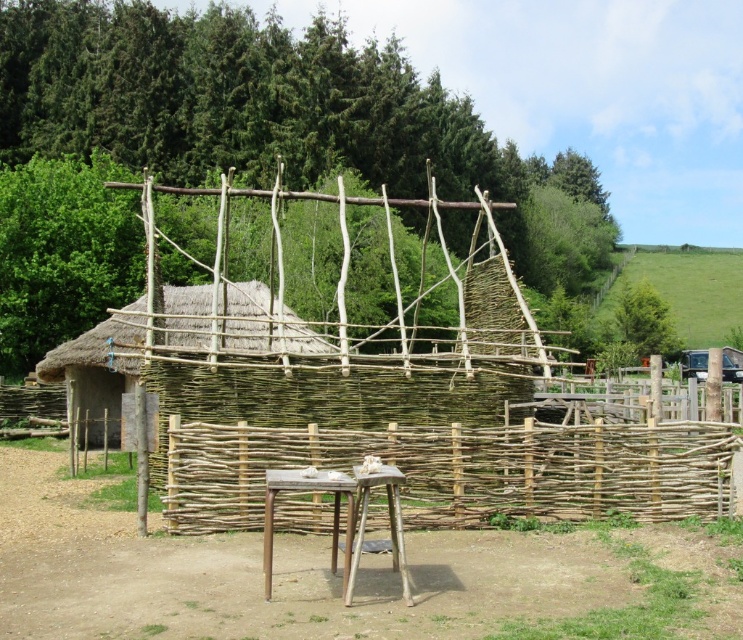
You are standing in front of the rustic structure and want to place a heavy object on the ground near the thatched straw hut at center. Based on the scene, where should you place it to ensure it stays on the brown dirt field at center?

The brown dirt field at center is below the thatched straw hut at center, so placing the heavy object on the brown dirt field at center near the base of the thatched straw hut at center will ensure it stays on the ground there.

You are an architect visiting a historical site and want to compare the sizes of the natural wood fence at center and the thatched straw hut at center. Which one is bigger?

The thatched straw hut at center is bigger than the natural wood fence at center.